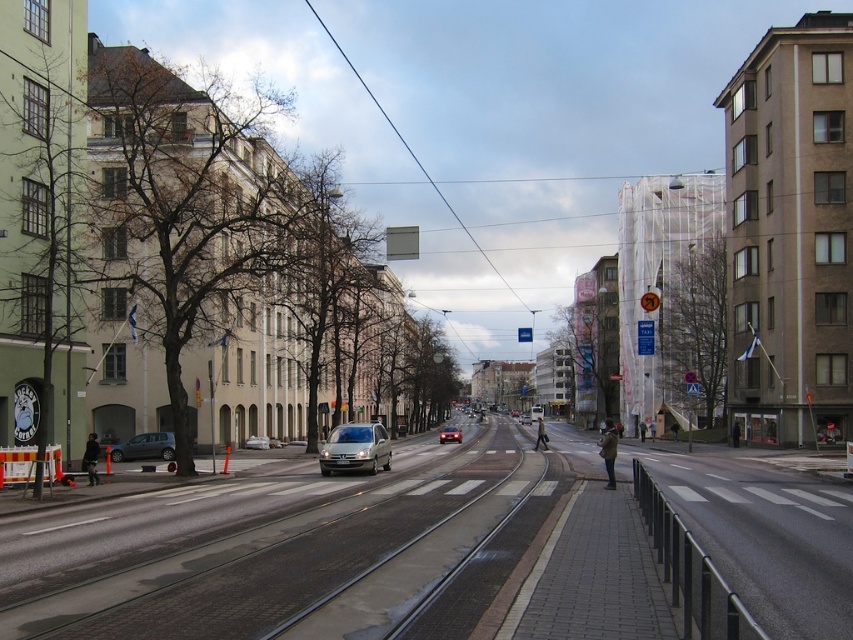
Does shiny silver sedan at center have a larger size compared to silver metallic sedan at center?

Yes.

Who is shorter, shiny silver sedan at center or silver metallic sedan at center?

Standing shorter between the two is silver metallic sedan at center.

Looking at this image, who is more forward, (440, 436) or (527, 422)?

Point (440, 436)

This screenshot has width=853, height=640. I want to click on shiny silver sedan at center, so click(x=450, y=433).

Is matte gray car at left closer to the viewer compared to silver metallic sedan at center?

Yes, matte gray car at left is in front of silver metallic sedan at center.

Between matte gray car at left and silver metallic sedan at center, which one appears on the left side from the viewer's perspective?

matte gray car at left is more to the left.

What do you see at coordinates (144, 448) in the screenshot? The image size is (853, 640). I see `matte gray car at left` at bounding box center [144, 448].

This screenshot has height=640, width=853. Identify the location of matte gray car at left. [144, 448].

Is satin silver van at center bigger than matte gray car at left?

Indeed, satin silver van at center has a larger size compared to matte gray car at left.

Is satin silver van at center wider than matte gray car at left?

Correct, the width of satin silver van at center exceeds that of matte gray car at left.

Is point (355, 426) closer to viewer compared to point (135, 452)?

That is True.

Identify the location of satin silver van at center. (355, 449).